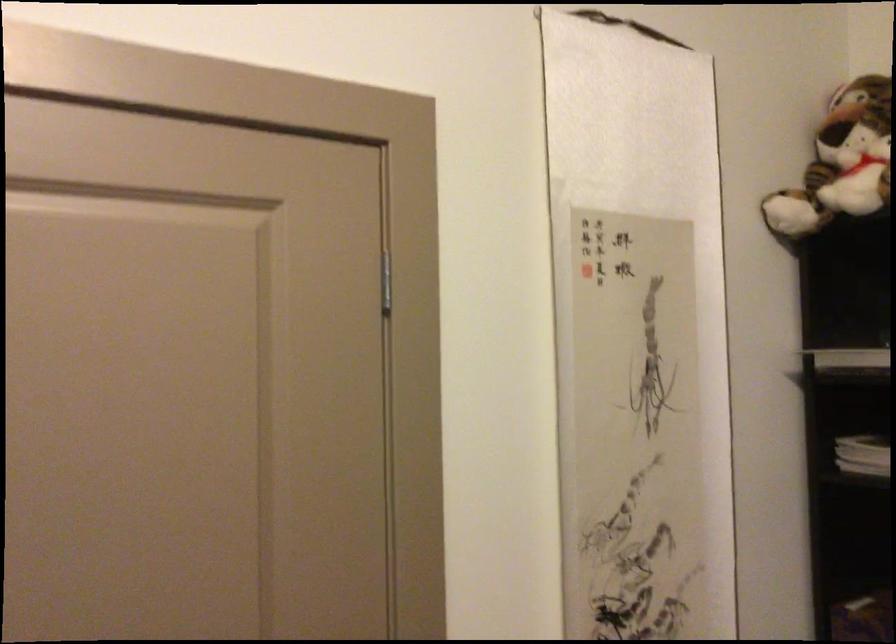
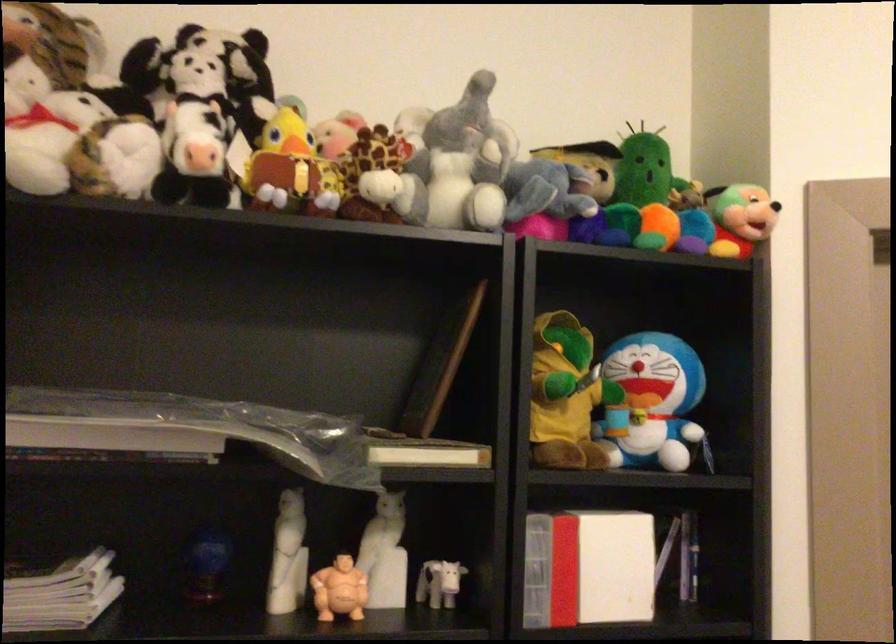
Question: Based on the continuous images, in which direction is the camera rotating? Reply with the corresponding letter.

Choices:
 (A) Left
 (B) Right
 (C) Up
 (D) Down

Answer: (B)